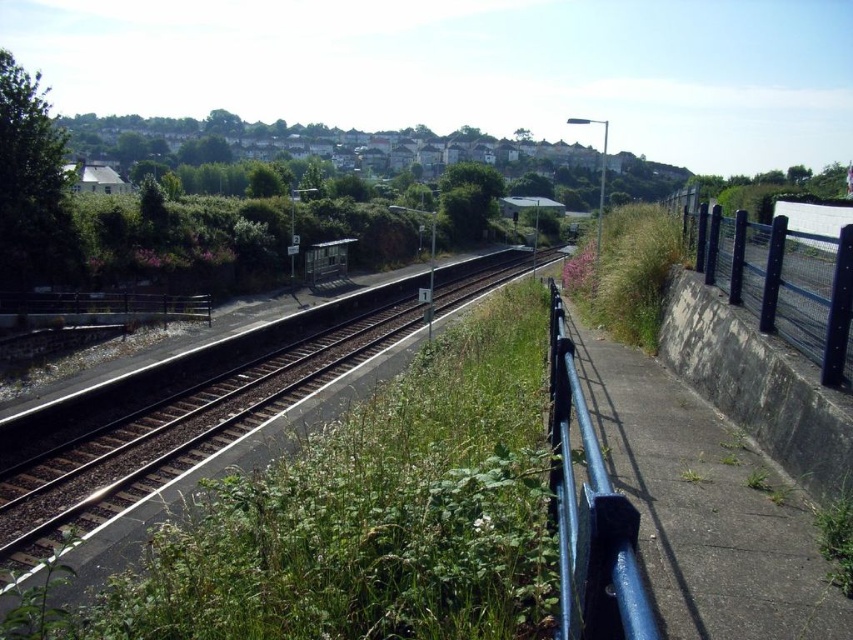
Based on the photo, you are a maintenance worker needing to cross from the grassy area to the railway tracks. The blue metallic rail at right and the black metal fence at right are both on your right side. Can you safely walk between them without stepping into the tracks?

The distance between the blue metallic rail at right and the black metal fence at right is 7.24 meters, which is sufficient for a person to walk between them safely without stepping onto the tracks.

You are a maintenance worker assigned to inspect the brown wooden train track at center and the black metal fence at right. The safety protocol requires you to stay at least 50 feet away from active tracks. Based on the distance between them, can you safely perform your inspection near both objects without violating the safety rule?

The brown wooden train track at center is 47.38 feet from the black metal fence at right, which is less than the required 50 feet safety distance. Therefore, you cannot safely perform the inspection near both objects without violating the safety protocol.

A person is standing at the point labeled point (508,264). They want to walk to the shelter structure on the left platform. How far will they have to walk?

The distance between the point labeled point (508,264) and the shelter structure on the left platform is 85.09 meters, so they will have to walk 85.09 meters.